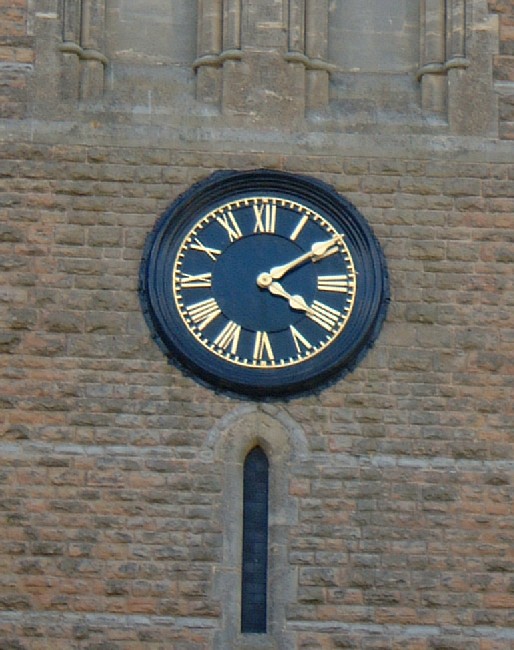
The image size is (514, 650). What are the coordinates of `longer hand of the clock` in the screenshot? It's located at (300, 257).